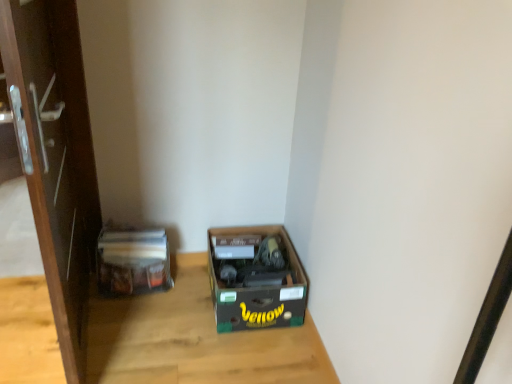
Identify the location of vacant space situated above wooden table at center (from a real-world perspective). (109, 336).